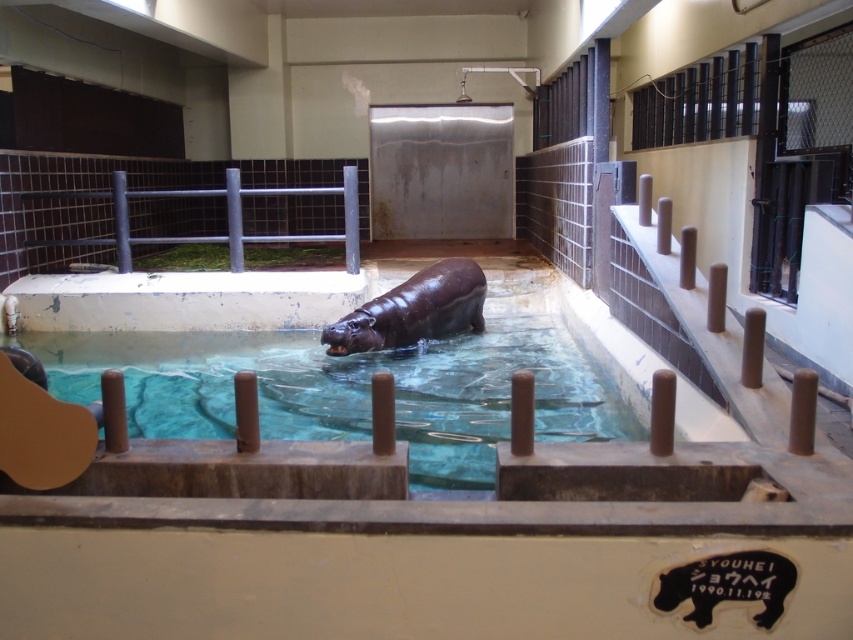
Looking at this image, you are a zookeeper preparing to clean the enclosure. The translucent glass pool at center needs to be drained for maintenance. Considering the shiny brown hippo at center is currently in the pool, can you estimate if there is enough space to move the hippo to the dry area while draining the pool?

The translucent glass pool at center is wider than the shiny brown hippo at center. Since the pool is larger in width, there should be enough space to move the hippo to the dry area while draining the pool.

You are a zookeeper who needs to clean the enclosure. You have a cleaning tool that can only reach up to 2 meters. The distance between the translucent glass pool at center and the metallic gray rail at upper left is 3 meters. Can you safely clean the area between them without needing to move the tool beyond its reach?

The distance between the translucent glass pool at center and the metallic gray rail at upper left is 3 meters, which exceeds the tool reach of 2 meters. Therefore, you cannot safely clean the entire area between them without moving the tool beyond its limit.

You are a zookeeper who needs to feed the shiny brown hippo at center. The metallic gray rail at upper left is part of the visitor viewing area. Can you safely approach the hippo without getting too close to the rail?

The metallic gray rail at upper left is 6.10 feet away from the shiny brown hippo at center, so yes, you can safely approach the hippo while maintaining a safe distance from the rail.